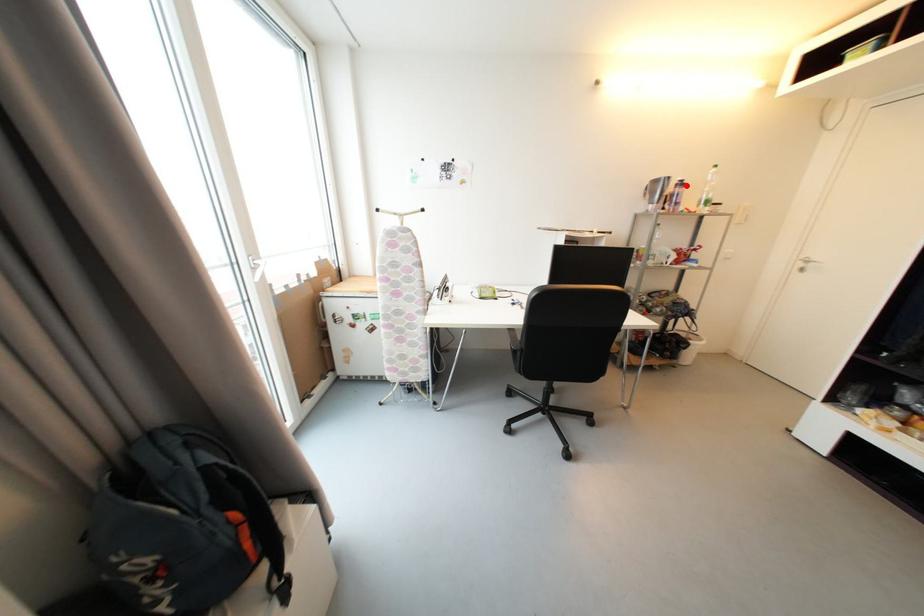
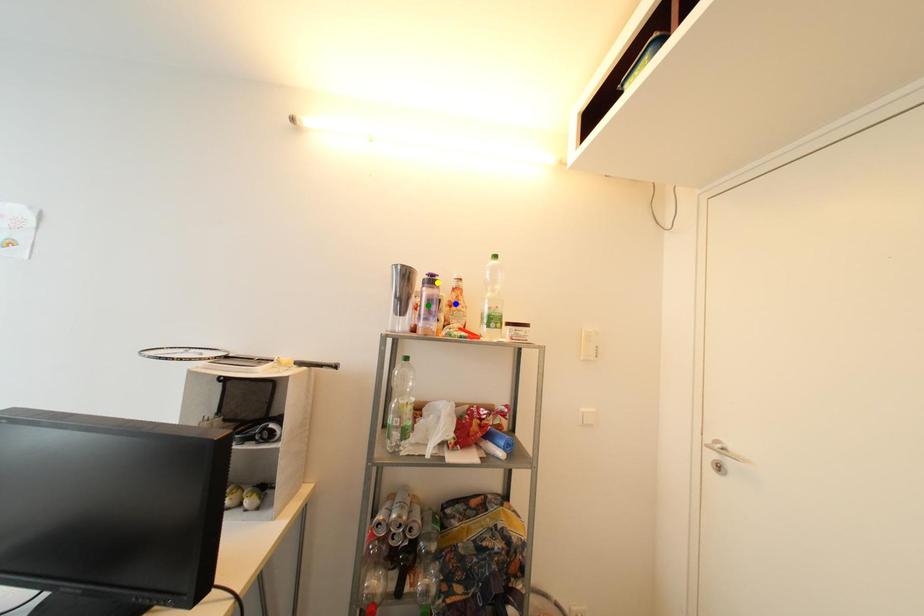
Question: I am providing you with two images of the same scene from different viewpoints. A red point is marked on the first image. You are given multiple points on the second image. Which spot in image 2 lines up with the point in image 1?

Choices:
 (A) green point
 (B) yellow point
 (C) blue point

Answer: (B)